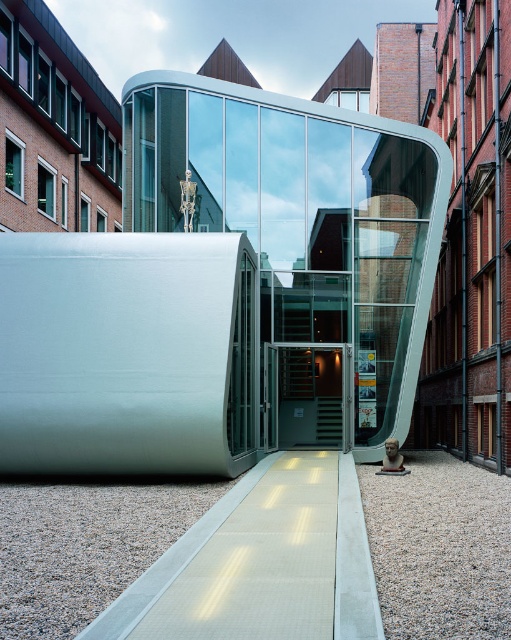
Question: Can you confirm if polished glass sculpture at center is positioned to the left of white textured walkway at center?

Choices:
 (A) yes
 (B) no

Answer: (A)

Question: Which object is positioned closest to the metallic glass door at center?

Choices:
 (A) polished glass sculpture at center
 (B) white textured walkway at center

Answer: (A)

Question: From the image, what is the correct spatial relationship of polished glass sculpture at center in relation to metallic glass door at center?

Choices:
 (A) left
 (B) right

Answer: (A)

Question: Is polished glass sculpture at center bigger than metallic glass door at center?

Choices:
 (A) yes
 (B) no

Answer: (A)

Question: Which is farther from the metallic glass door at center?

Choices:
 (A) polished glass sculpture at center
 (B) white textured walkway at center

Answer: (B)

Question: Which point is farther from the camera taking this photo?

Choices:
 (A) (151, 611)
 (B) (168, 104)
 (C) (287, 374)

Answer: (C)